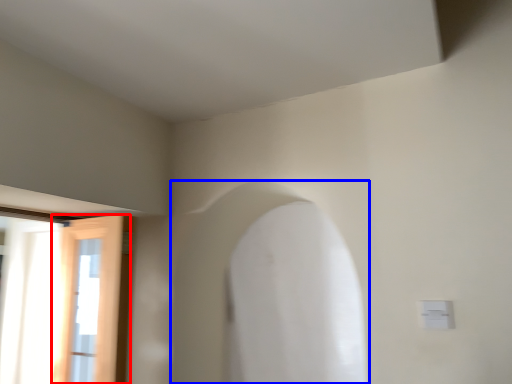
Question: Which object is further to the camera taking this photo, door (highlighted by a red box) or archway (highlighted by a blue box)?

Choices:
 (A) door
 (B) archway

Answer: (A)